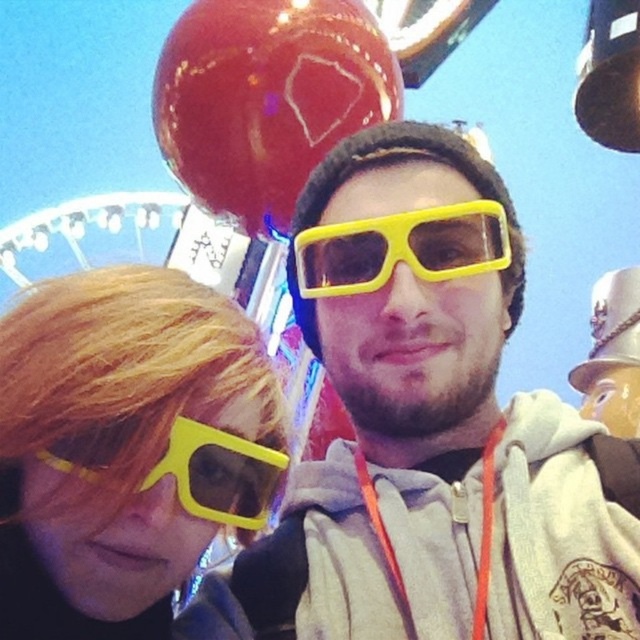
Which is more to the left, yellow matte sunglasses at center or yellow matte sunglasses at lower left?

yellow matte sunglasses at lower left

What do you see at coordinates (401, 248) in the screenshot? I see `yellow matte sunglasses at center` at bounding box center [401, 248].

This screenshot has width=640, height=640. Describe the element at coordinates (401, 248) in the screenshot. I see `yellow matte sunglasses at center` at that location.

Locate an element on the screen. Image resolution: width=640 pixels, height=640 pixels. yellow matte sunglasses at center is located at coordinates (401, 248).

Can you confirm if glossy red balloon at upper center is positioned to the right of yellow matte sunglasses at lower left?

Correct, you'll find glossy red balloon at upper center to the right of yellow matte sunglasses at lower left.

Who is taller, glossy red balloon at upper center or yellow matte sunglasses at lower left?

glossy red balloon at upper center

Is point (228, 45) positioned before point (237, 481)?

No, (228, 45) is behind (237, 481).

Where is `glossy red balloon at upper center`? glossy red balloon at upper center is located at coordinates (266, 99).

Who is shorter, matte yellow sunglasses at left or yellow matte sunglasses at lower left?

Standing shorter between the two is yellow matte sunglasses at lower left.

Between matte yellow sunglasses at left and yellow matte sunglasses at lower left, which one has more height?

Standing taller between the two is matte yellow sunglasses at left.

Locate an element on the screen. The image size is (640, 640). matte yellow sunglasses at left is located at coordinates (125, 448).

The image size is (640, 640). Identify the location of matte yellow sunglasses at left. (125, 448).